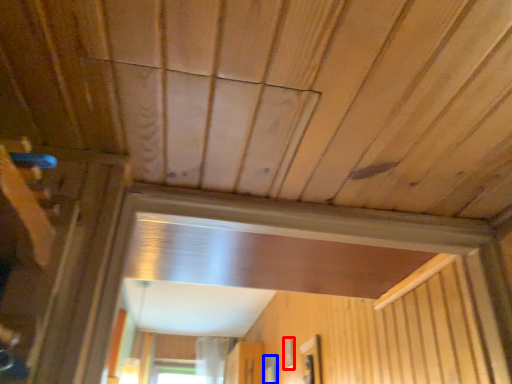
Question: Which of the following is the closest to the observer, window (highlighted by a red box) or window (highlighted by a blue box)?

Choices:
 (A) window
 (B) window

Answer: (A)